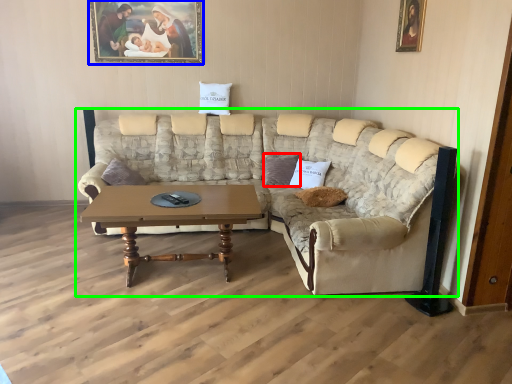
Question: Which object is the farthest from pillow (highlighted by a red box)? Choose among these: picture frame (highlighted by a blue box) or studio couch (highlighted by a green box).

Choices:
 (A) picture frame
 (B) studio couch

Answer: (A)